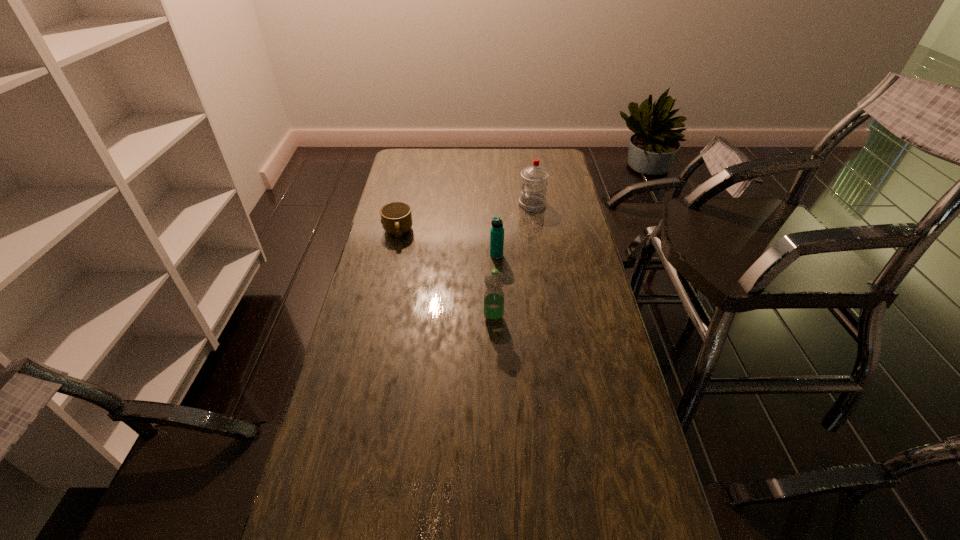
Where is `vacant area located on the left of the nearest water bottle`? Image resolution: width=960 pixels, height=540 pixels. vacant area located on the left of the nearest water bottle is located at coordinates (446, 318).

The width and height of the screenshot is (960, 540). In order to click on free space located 0.220m on the right of the shortest water bottle in this screenshot , I will do `click(563, 255)`.

Image resolution: width=960 pixels, height=540 pixels. What are the coordinates of `free region located 0.100m on the side with the handle of the mug` in the screenshot? It's located at point(391,262).

Where is `object present at the left edge`? The height and width of the screenshot is (540, 960). object present at the left edge is located at coordinates (396, 218).

The width and height of the screenshot is (960, 540). I want to click on object located in the right edge section of the desktop, so click(x=534, y=178).

I want to click on free point at the far edge, so click(504, 154).

Locate an element on the screen. free location at the left edge of the desktop is located at coordinates (395, 251).

Find the location of `vacant space at the right edge`. vacant space at the right edge is located at coordinates (605, 392).

Identify the location of free space at the far left corner. (427, 169).

In the image, there is a desktop. Find the location of `vacant space at the far right corner`. vacant space at the far right corner is located at coordinates (563, 159).